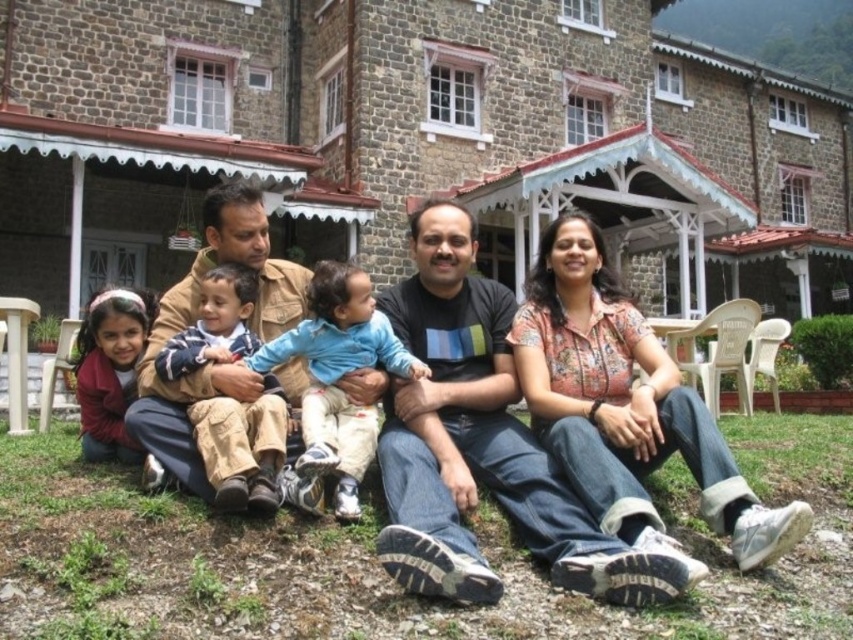
You are a photographer trying to capture a closeup of the floral print shirt at center without the matte red sweater at lower left being visible. Is this possible given their current positions?

The floral print shirt at center is positioned over the matte red sweater at lower left, so it is possible to capture a closeup of the floral print shirt at center without the matte red sweater at lower left being visible by focusing on the upper area where the shirt is covering the sweater.